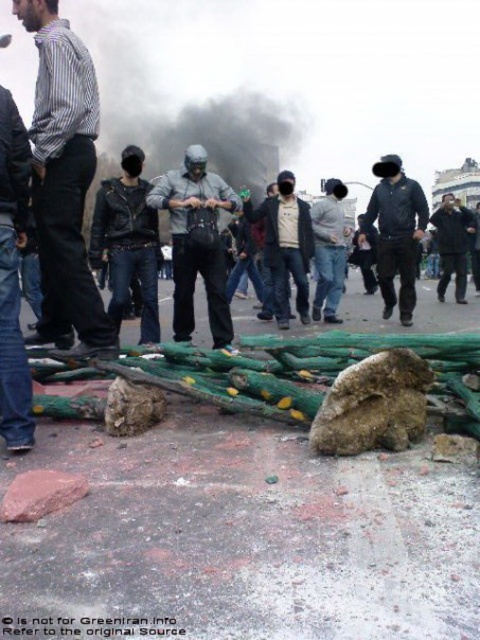
Who is lower down, denim jeans at left or dark gray jacket at center?

dark gray jacket at center is lower down.

Can you confirm if denim jeans at left is wider than dark gray jacket at center?

Yes, denim jeans at left is wider than dark gray jacket at center.

Does point (6, 333) lie in front of point (447, 218)?

Yes, it is.

At what (x,y) coordinates should I click in order to perform the action: click on denim jeans at left. Please return your answer as a coordinate pair (x, y). The height and width of the screenshot is (640, 480). Looking at the image, I should click on (12, 278).

Does gray matte helmet at center have a lesser height compared to dark gray jacket at center?

No.

Can you confirm if gray matte helmet at center is positioned to the left of dark gray jacket at center?

Correct, you'll find gray matte helmet at center to the left of dark gray jacket at center.

Which is behind, point (200, 269) or point (442, 282)?

Positioned behind is point (442, 282).

Image resolution: width=480 pixels, height=640 pixels. I want to click on gray matte helmet at center, so click(196, 243).

Does dark blue jacket at center have a greater height compared to dark gray jacket at center?

Correct, dark blue jacket at center is much taller as dark gray jacket at center.

Between point (360, 237) and point (453, 228), which one is positioned in front?

Positioned in front is point (453, 228).

Does point (371, 198) come closer to viewer compared to point (446, 252)?

Yes, point (371, 198) is in front of point (446, 252).

Find the location of a particular element. dark blue jacket at center is located at coordinates (396, 232).